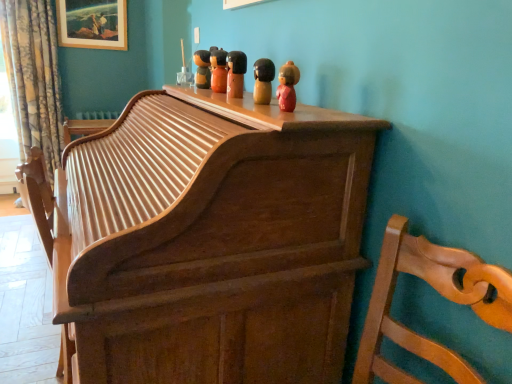
Identify the location of free space in front of wooden figurine at upper center, which is counted as the first toy, starting from the front. (287, 124).